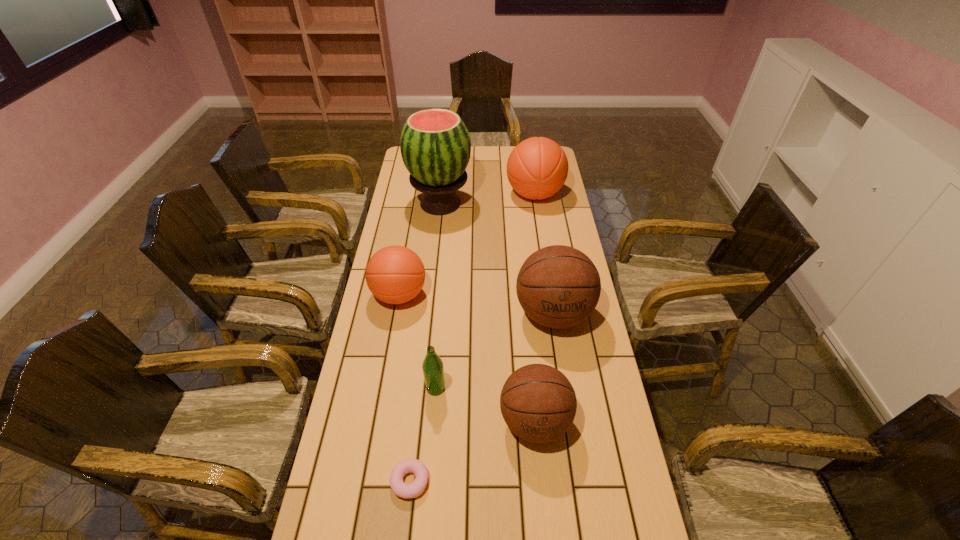
This screenshot has width=960, height=540. What are the coordinates of `vacant area between the bottle and the bigger orange basketball` in the screenshot? It's located at (485, 291).

This screenshot has width=960, height=540. I want to click on the fifth closest object to the smaller orange basketball, so (537, 168).

Identify which object is the nearest to the nearest basketball. Please provide its 2D coordinates. Your answer should be formatted as a tuple, i.e. [(x, y)], where the tuple contains the x and y coordinates of a point satisfying the conditions above.

[(433, 369)]

Identify which basketball is the closest to the tallest object. Please provide its 2D coordinates. Your answer should be formatted as a tuple, i.e. [(x, y)], where the tuple contains the x and y coordinates of a point satisfying the conditions above.

[(537, 168)]

Select which basketball appears as the closest to the doughnut. Please provide its 2D coordinates. Your answer should be formatted as a tuple, i.e. [(x, y)], where the tuple contains the x and y coordinates of a point satisfying the conditions above.

[(538, 403)]